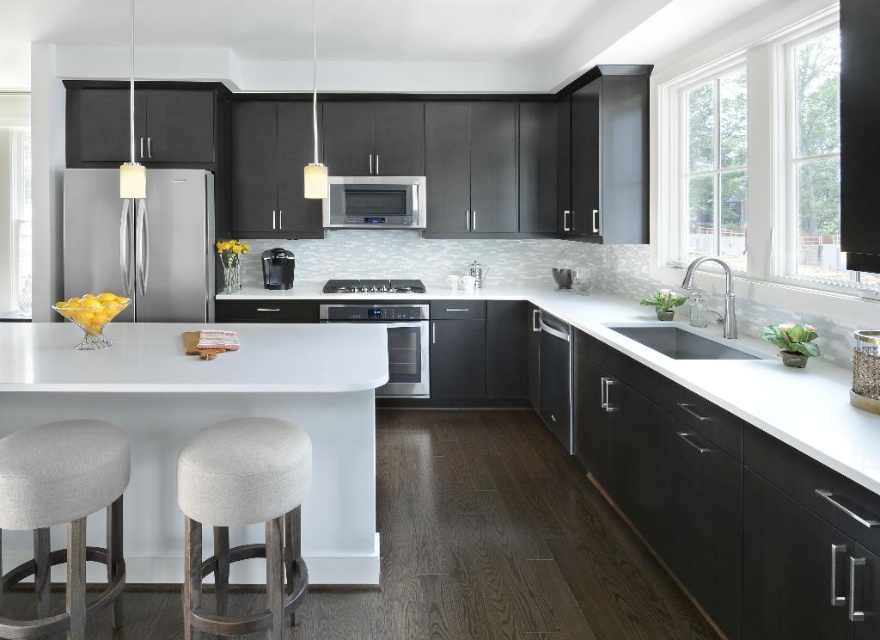
You are a delivery person who needs to place a new appliance that is 1.5 meters wide between the satin stainless steel microwave at center and the black matte dishwasher at lower center. Will there be enough space to fit it?

The satin stainless steel microwave at center and the black matte dishwasher at lower center are 1.54 meters apart. Since the new appliance is 1.5 meters wide, there will be enough space to fit it as the distance between them is slightly larger than the appliance.

You are standing in the kitchen and want to place a small plant on the island. The plant requires a spot that is not occupied by any objects. Based on the coordinates provided, can you determine if there is space between the gray fabric bar stool at lower left and the edge of the island? Please explain your reasoning.

The gray fabric bar stool at lower left is positioned at coordinates point (63, 515). Since the coordinates are relative to the image frame, the exact distance from the stool to the edge of the island cannot be determined without additional spatial information. However, the description does not mention any other objects near the stool, suggesting there might be space available for the plant.